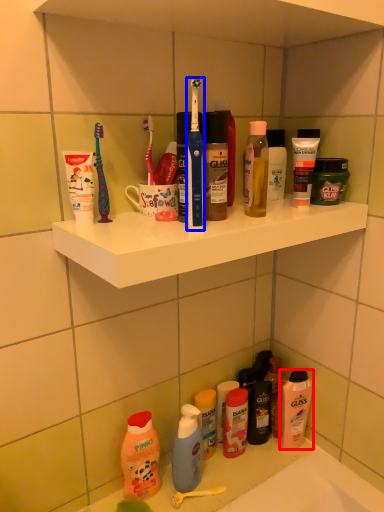
Question: Which object is further to the camera taking this photo, cleaning product (highlighted by a red box) or toothbrush (highlighted by a blue box)?

Choices:
 (A) cleaning product
 (B) toothbrush

Answer: (A)